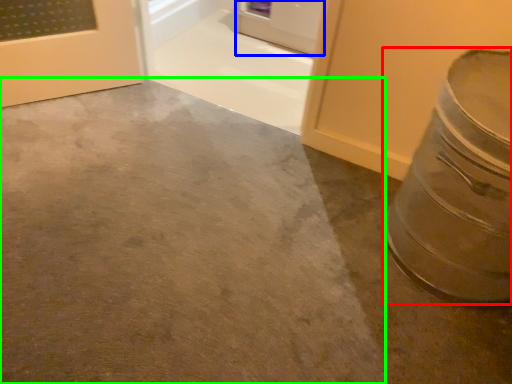
Question: Based on their relative distances, which object is nearer to crock pot (highlighted by a red box)? Choose from door (highlighted by a blue box) and concrete (highlighted by a green box).

Choices:
 (A) door
 (B) concrete

Answer: (B)